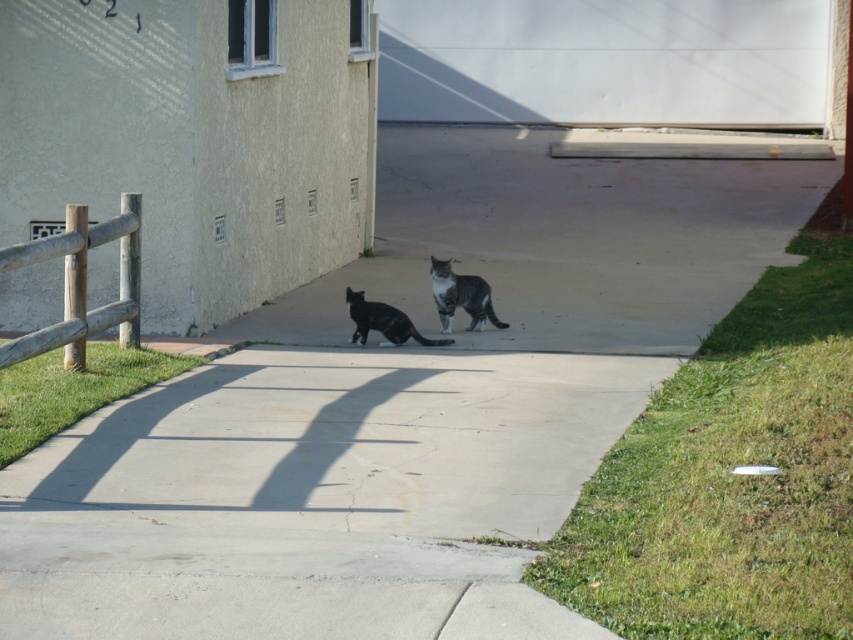
You are a photographer trying to capture a closeup shot of both the striped fur cat at center and the shiny black cat at center. Your camera can focus on subjects within a 20 inch range. Can you fit both cats into the frame without moving your camera?

The striped fur cat at center and the shiny black cat at center are 25.20 inches apart, which is beyond the camera focus range of 20 inches. Therefore, you cannot fit both cats into the frame without moving the camera.